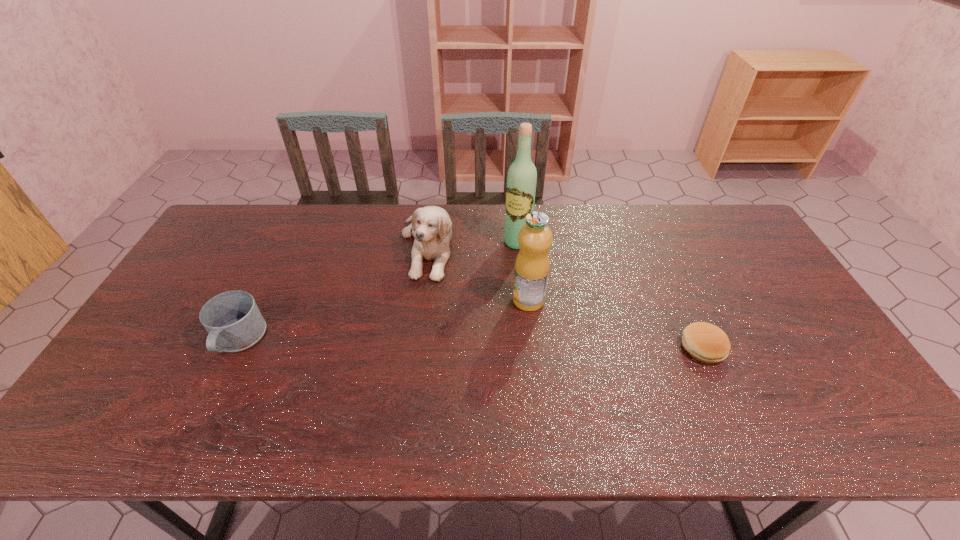
Find the location of a particular element. The image size is (960, 540). free space in the image that satisfies the following two spatial constraints: 1. on the front side of the third shortest object; 2. on the left side of the fruit juice is located at coordinates point(420,300).